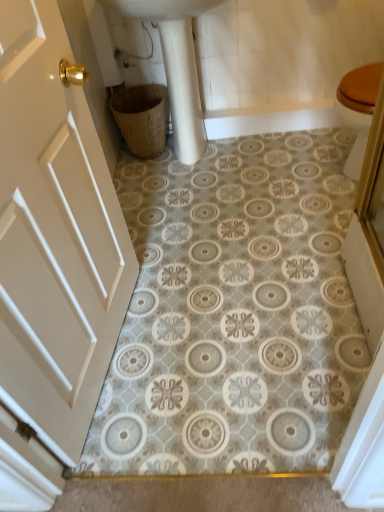
Question: Does woven brown basket at lower left have a greater height compared to white glossy sink at upper center?

Choices:
 (A) no
 (B) yes

Answer: (A)

Question: From a real-world perspective, does woven brown basket at lower left sit lower than white glossy sink at upper center?

Choices:
 (A) no
 (B) yes

Answer: (B)

Question: Can you see woven brown basket at lower left touching white glossy sink at upper center?

Choices:
 (A) no
 (B) yes

Answer: (A)

Question: From the image's perspective, is woven brown basket at lower left on top of white glossy sink at upper center?

Choices:
 (A) no
 (B) yes

Answer: (A)

Question: Is woven brown basket at lower left smaller than white glossy sink at upper center?

Choices:
 (A) yes
 (B) no

Answer: (A)

Question: From the image's perspective, is woven brown basket at lower left below white glossy sink at upper center?

Choices:
 (A) no
 (B) yes

Answer: (B)

Question: From a real-world perspective, is white matte door at left below woven brown basket at lower left?

Choices:
 (A) yes
 (B) no

Answer: (B)

Question: From a real-world perspective, is white matte door at left physically above woven brown basket at lower left?

Choices:
 (A) yes
 (B) no

Answer: (A)

Question: Is white matte door at left behind woven brown basket at lower left?

Choices:
 (A) yes
 (B) no

Answer: (B)

Question: Does white matte door at left have a larger size compared to woven brown basket at lower left?

Choices:
 (A) no
 (B) yes

Answer: (B)

Question: Is white matte door at left shorter than woven brown basket at lower left?

Choices:
 (A) no
 (B) yes

Answer: (A)

Question: Can you confirm if white matte door at left is wider than woven brown basket at lower left?

Choices:
 (A) yes
 (B) no

Answer: (B)

Question: Considering the relative sizes of white matte door at left and white glossy sink at upper center in the image provided, is white matte door at left wider than white glossy sink at upper center?

Choices:
 (A) no
 (B) yes

Answer: (A)